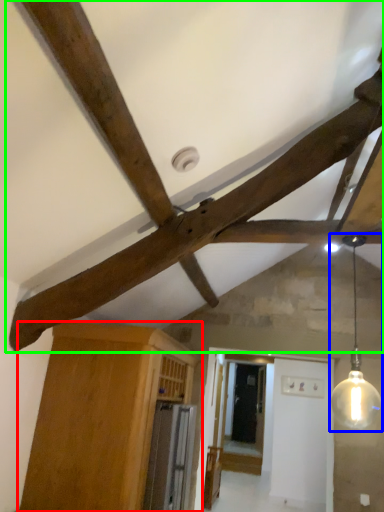
Question: Which object is positioned farthest from cabinetry (highlighted by a red box)? Select from light fixture (highlighted by a blue box) and fan (highlighted by a green box).

Choices:
 (A) light fixture
 (B) fan

Answer: (A)